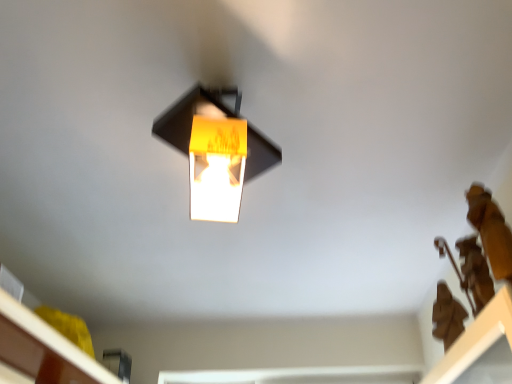
Find the location of `matte black lamp at upper center`. matte black lamp at upper center is located at coordinates (216, 150).

From the picture: Measure the distance between matte black lamp at upper center and camera.

matte black lamp at upper center and camera are 89.73 centimeters apart from each other.

Measure the distance between point [224,89] and camera.

They are 3.76 feet apart.

Describe the element at coordinates (216, 150) in the screenshot. I see `matte black lamp at upper center` at that location.

Identify the location of matte black lamp at upper center. (216, 150).